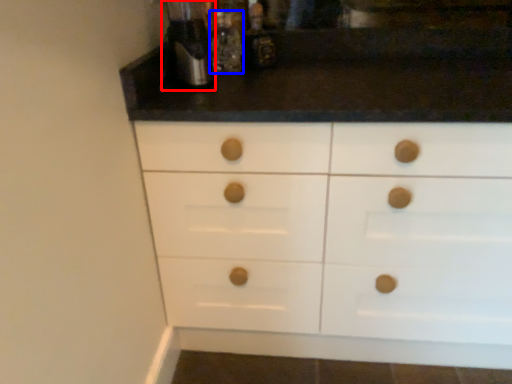
Question: Which point is closer to the camera, coffee machine (highlighted by a red box) or bottle (highlighted by a blue box)?

Choices:
 (A) coffee machine
 (B) bottle

Answer: (A)